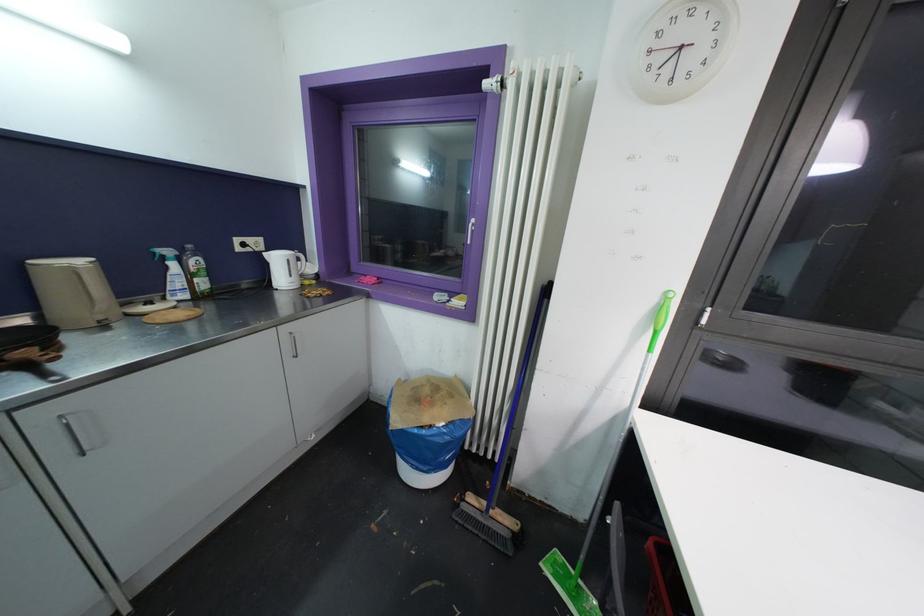
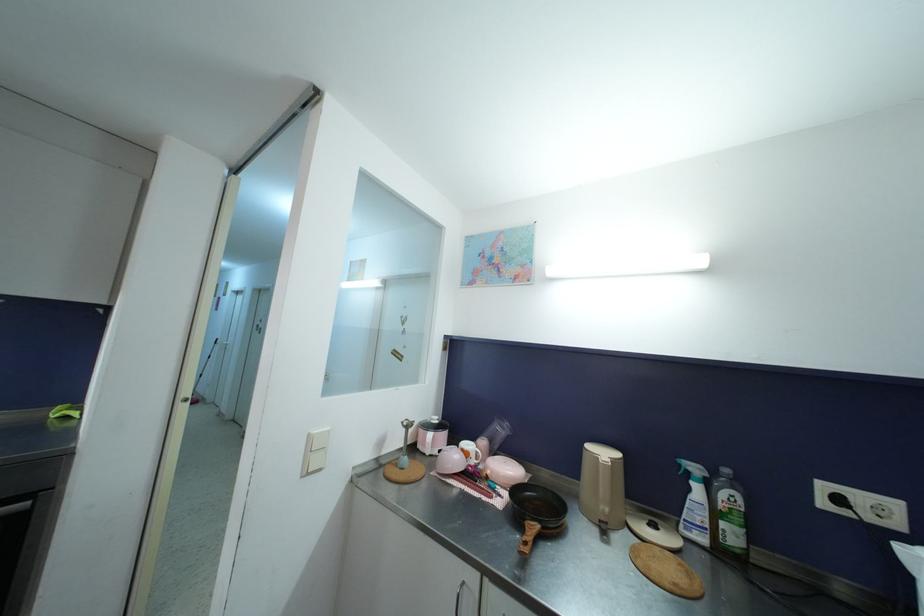
Locate, in the second image, the point that corresponds to [171,254] in the first image.

(699, 472)